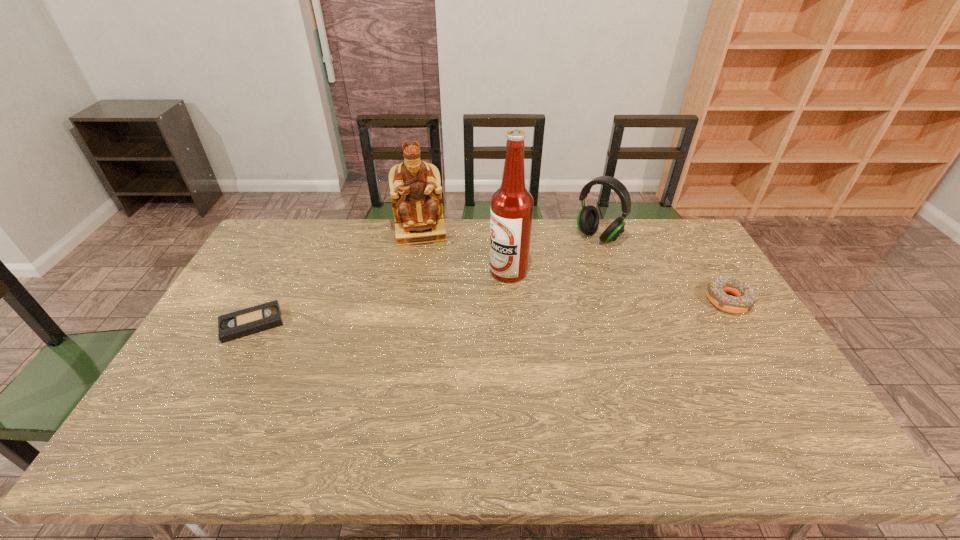
I want to click on free space on the desktop that is between the shortest object and the second shortest object and is positioned on the ear cups of the third tallest object, so click(516, 310).

The height and width of the screenshot is (540, 960). Identify the location of vacant space on the desktop that is between the leftmost object and the fourth tallest object and is positioned on the label side of the third farthest object. [445, 314].

You are a GUI agent. You are given a task and a screenshot of the screen. Output one action in this format:
    pyautogui.click(x=<x>, y=<y>)
    Task: Click on the vacant space on the desktop that is between the videotape and the rightmost object and is positioned on the front-facing side of the figurine
    
    Given the screenshot: What is the action you would take?
    pyautogui.click(x=428, y=315)